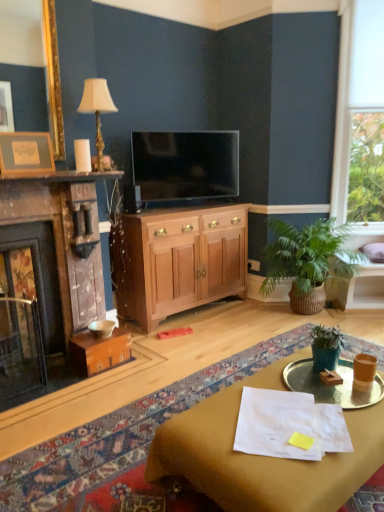
Locate an element on the screen. empty space that is ontop of translucent glass tray at center (from a real-world perspective) is located at coordinates (331, 381).